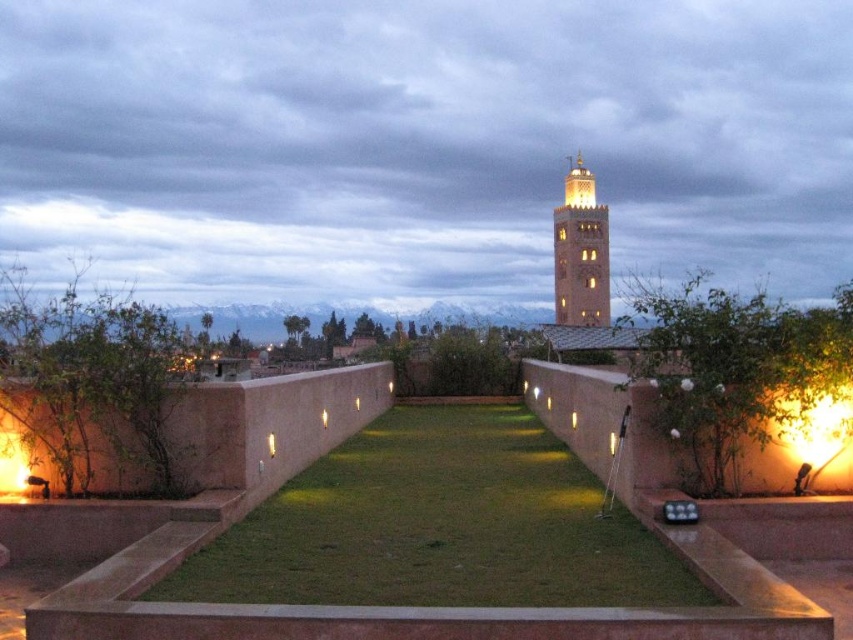
Question: Which object appears closest to the camera in this image?

Choices:
 (A) light brown stone minaret at upper center
 (B) green grass at center

Answer: (B)

Question: Does green grass at center have a larger size compared to light brown stone minaret at upper center?

Choices:
 (A) no
 (B) yes

Answer: (A)

Question: Can you confirm if green grass at center is smaller than light brown stone minaret at upper center?

Choices:
 (A) no
 (B) yes

Answer: (B)

Question: Is green grass at center to the left of light brown stone minaret at upper center from the viewer's perspective?

Choices:
 (A) yes
 (B) no

Answer: (A)